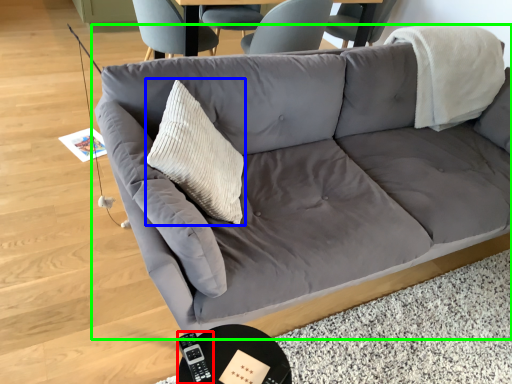
Question: Which object is the closest to the remote (highlighted by a red box)? Choose among these: throw pillow (highlighted by a blue box) or studio couch (highlighted by a green box).

Choices:
 (A) throw pillow
 (B) studio couch

Answer: (A)